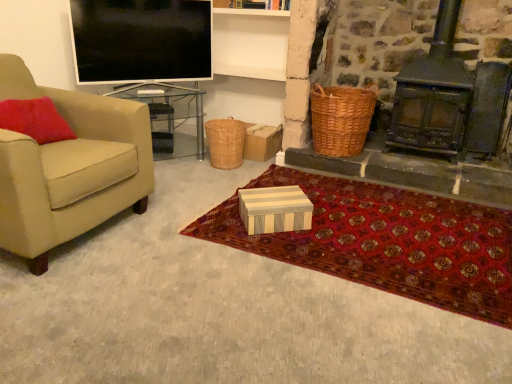
Question: Considering the relative positions of woven brown picnic basket at center, marked as the first picnic basket in a left-to-right arrangement, and red carpet at center in the image provided, is woven brown picnic basket at center, marked as the first picnic basket in a left-to-right arrangement, to the left of red carpet at center from the viewer's perspective?

Choices:
 (A) no
 (B) yes

Answer: (B)

Question: From the image's perspective, does woven brown picnic basket at center, the 2th picnic basket positioned from the right, appear lower than red carpet at center?

Choices:
 (A) no
 (B) yes

Answer: (A)

Question: Considering the relative sizes of woven brown picnic basket at center, marked as the first picnic basket in a left-to-right arrangement, and red carpet at center in the image provided, is woven brown picnic basket at center, marked as the first picnic basket in a left-to-right arrangement, bigger than red carpet at center?

Choices:
 (A) yes
 (B) no

Answer: (B)

Question: Is woven brown picnic basket at center, marked as the first picnic basket in a left-to-right arrangement, closer to the viewer compared to red carpet at center?

Choices:
 (A) yes
 (B) no

Answer: (B)

Question: From a real-world perspective, is woven brown picnic basket at center, the 2th picnic basket positioned from the right, over red carpet at center?

Choices:
 (A) no
 (B) yes

Answer: (B)

Question: From the image's perspective, is woven brown picnic basket at center, marked as the first picnic basket in a left-to-right arrangement, above red carpet at center?

Choices:
 (A) no
 (B) yes

Answer: (B)

Question: From a real-world perspective, is white striped wood box at center, which ranks as the 1th box in right-to-left order, positioned over red carpet at center based on gravity?

Choices:
 (A) no
 (B) yes

Answer: (B)

Question: Does white striped wood box at center, placed as the second box when sorted from left to right, have a smaller size compared to red carpet at center?

Choices:
 (A) yes
 (B) no

Answer: (A)

Question: Are white striped wood box at center, placed as the second box when sorted from left to right, and red carpet at center far apart?

Choices:
 (A) no
 (B) yes

Answer: (A)

Question: From a real-world perspective, is white striped wood box at center, which ranks as the second box in back-to-front order, under red carpet at center?

Choices:
 (A) no
 (B) yes

Answer: (A)

Question: Is white striped wood box at center, positioned as the 1th box in bottom-to-top order, completely or partially outside of red carpet at center?

Choices:
 (A) no
 (B) yes

Answer: (B)

Question: Does white striped wood box at center, the 2th box in the top-to-bottom sequence, have a greater height compared to red carpet at center?

Choices:
 (A) no
 (B) yes

Answer: (B)

Question: Considering the relative positions of flat screen tv at upper left and red carpet at center in the image provided, is flat screen tv at upper left to the right of red carpet at center from the viewer's perspective?

Choices:
 (A) no
 (B) yes

Answer: (A)